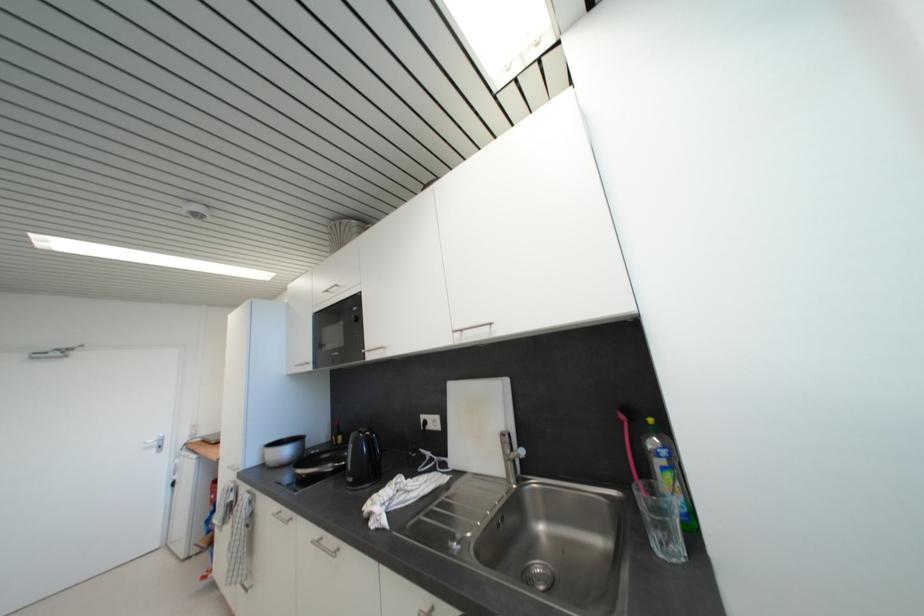
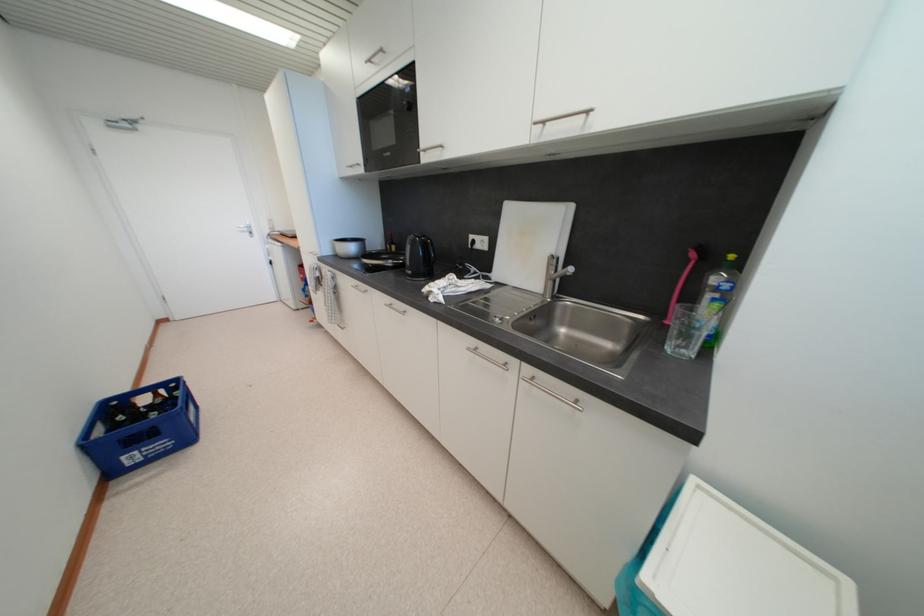
Find the pixel in the second image that matches (x=675, y=477) in the first image.

(723, 307)